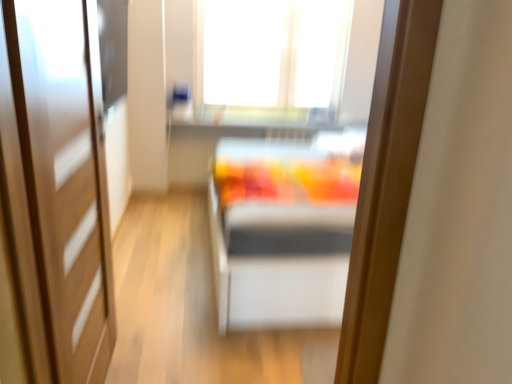
Question: Is wooden door at left taller or shorter than transparent glass window at upper center?

Choices:
 (A) tall
 (B) short

Answer: (A)

Question: Is wooden door at left inside the boundaries of transparent glass window at upper center, or outside?

Choices:
 (A) inside
 (B) outside

Answer: (B)

Question: From a real-world perspective, relative to transparent glass window at upper center, is wooden door at left vertically above or below?

Choices:
 (A) below
 (B) above

Answer: (A)

Question: From a real-world perspective, is transparent glass window at upper center physically located above or below wooden door at left?

Choices:
 (A) above
 (B) below

Answer: (A)

Question: From their relative heights in the image, would you say transparent glass window at upper center is taller or shorter than wooden door at left?

Choices:
 (A) tall
 (B) short

Answer: (B)

Question: Visually, is transparent glass window at upper center positioned to the left or to the right of wooden door at left?

Choices:
 (A) left
 (B) right

Answer: (B)

Question: Is transparent glass window at upper center bigger or smaller than wooden door at left?

Choices:
 (A) big
 (B) small

Answer: (A)